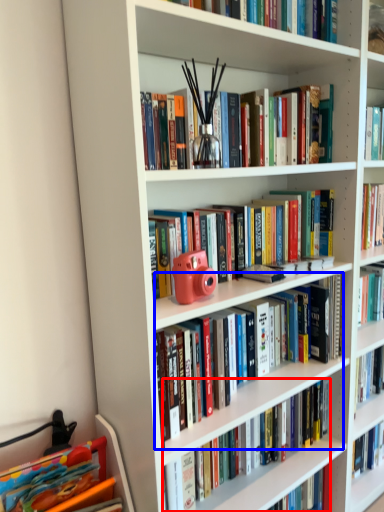
Question: Which of the following is the farthest to the observer, book (highlighted by a red box) or book (highlighted by a blue box)?

Choices:
 (A) book
 (B) book

Answer: (A)